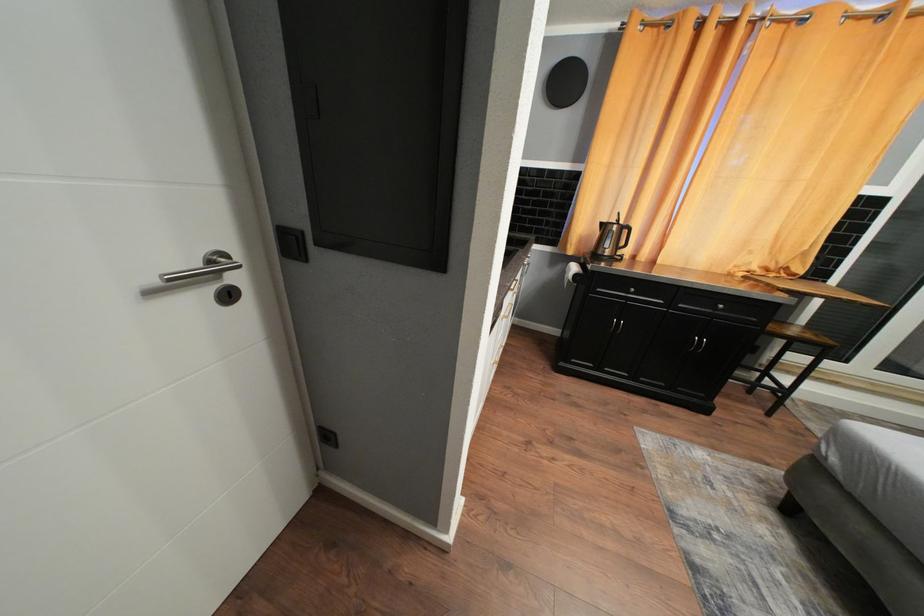
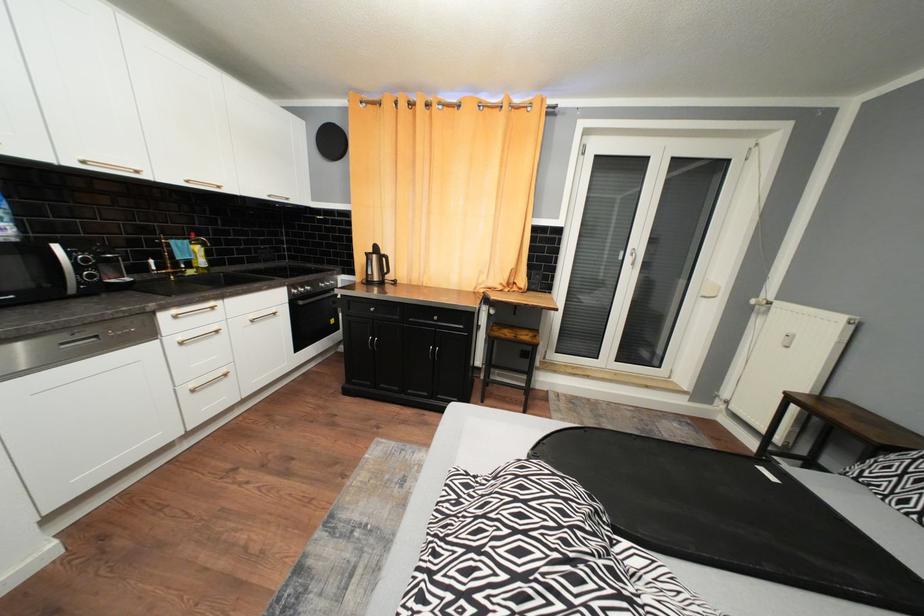
Question: Which direction would the cameraman need to move to produce the second image? Reply with the corresponding letter.

Choices:
 (A) Left
 (B) Right
 (C) Forward
 (D) Backward

Answer: (B)